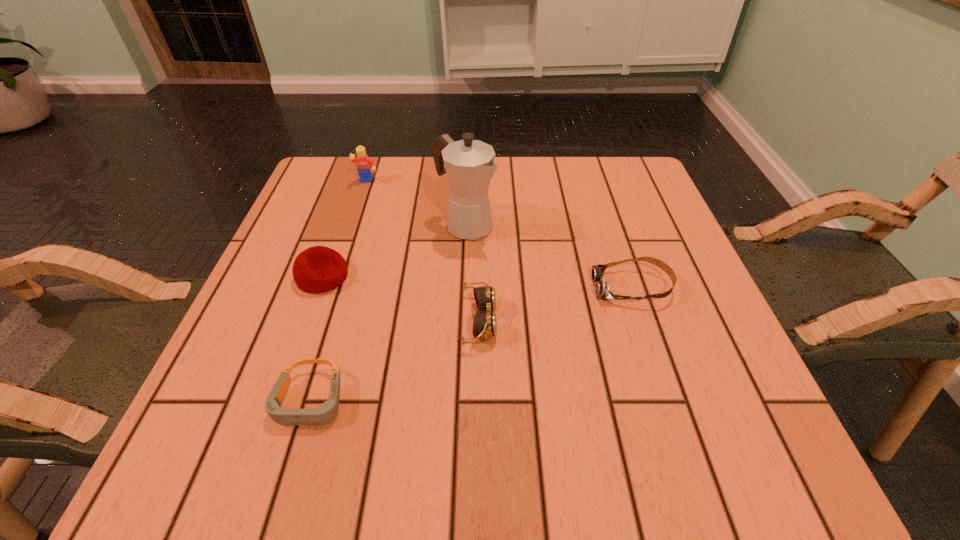
Image resolution: width=960 pixels, height=540 pixels. I want to click on beanbag at the left edge, so [318, 269].

In order to click on goggles at the left edge in this screenshot , I will do `click(326, 412)`.

Identify the location of object present at the right edge. (602, 290).

This screenshot has height=540, width=960. In order to click on object located at the far left corner in this screenshot , I will do `click(364, 163)`.

I want to click on object that is positioned at the near left corner, so click(326, 412).

The image size is (960, 540). I want to click on free spot at the far edge of the desktop, so click(x=580, y=210).

You are a GUI agent. You are given a task and a screenshot of the screen. Output one action in this format:
    pyautogui.click(x=<x>, y=<y>)
    Task: Click on the free region at the near edge of the desktop
    The image size is (960, 540).
    Given the screenshot: What is the action you would take?
    pyautogui.click(x=458, y=420)

In order to click on vacant space at the left edge of the desktop in this screenshot , I will do `click(343, 224)`.

In the image, there is a desktop. What are the coordinates of `vacant space at the right edge` in the screenshot? It's located at (660, 290).

This screenshot has width=960, height=540. In order to click on vacant space at the far left corner in this screenshot , I will do `click(358, 195)`.